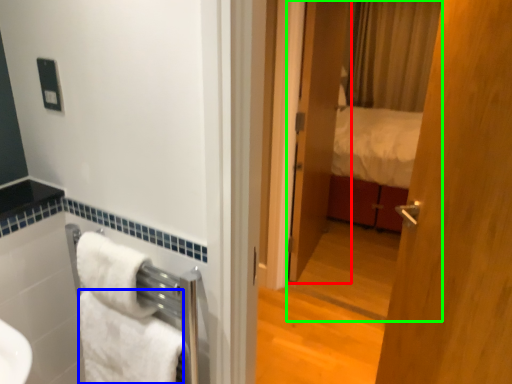
Question: Based on their relative distances, which object is farther from door (highlighted by a red box)? Choose from towel/napkin (highlighted by a blue box) and mirror (highlighted by a green box).

Choices:
 (A) towel/napkin
 (B) mirror

Answer: (A)